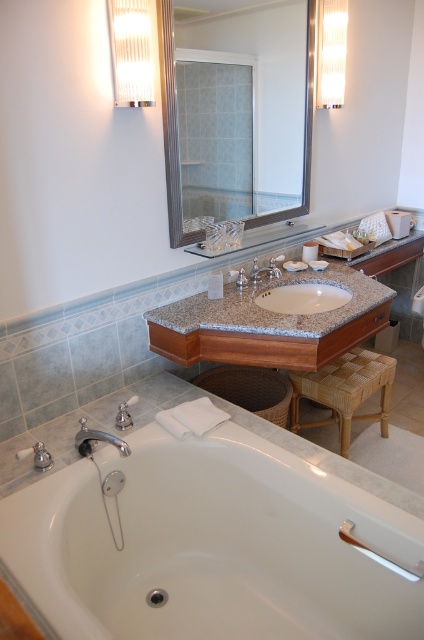
Question: Can you confirm if clear glass mirror at upper center is positioned above beige marble sink at center?

Choices:
 (A) no
 (B) yes

Answer: (B)

Question: Can you confirm if woven rattan stool at lower right is positioned above silver metallic faucet at lower left?

Choices:
 (A) no
 (B) yes

Answer: (A)

Question: Is beige marble sink at center above silver metallic faucet at lower left?

Choices:
 (A) yes
 (B) no

Answer: (A)

Question: Which point is farther from the camera taking this photo?

Choices:
 (A) (367, 272)
 (B) (169, 157)

Answer: (A)

Question: Which object is positioned closest to the clear glass mirror at upper center?

Choices:
 (A) silver metallic faucet at lower left
 (B) beige marble sink at center

Answer: (B)

Question: Based on their relative distances, which object is farther from the white glossy bathtub at lower left?

Choices:
 (A) clear glass mirror at upper center
 (B) beige marble sink at center
 (C) granite countertop at center

Answer: (A)